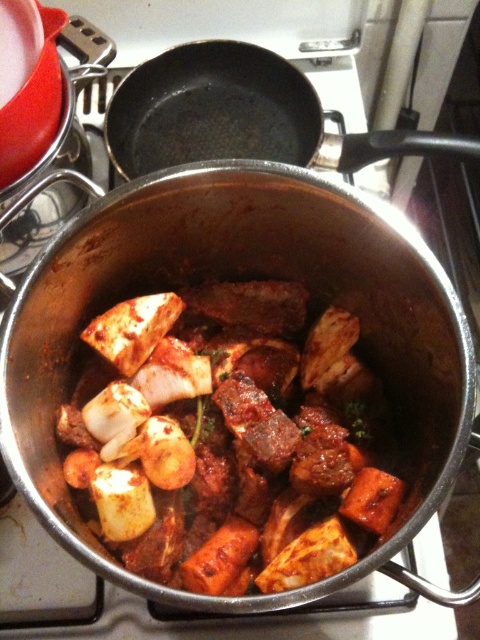
You are a chef standing in front of a stove with a pot and an empty pan. You need to check the contents of the pot without moving your position. Can you clearly see the spicy brown meat and vegetables at center from your current position?

The spicy brown meat and vegetables at center is 19.35 inches from camera, so yes, you can clearly see it from your current position as it is within a reasonable viewing distance.